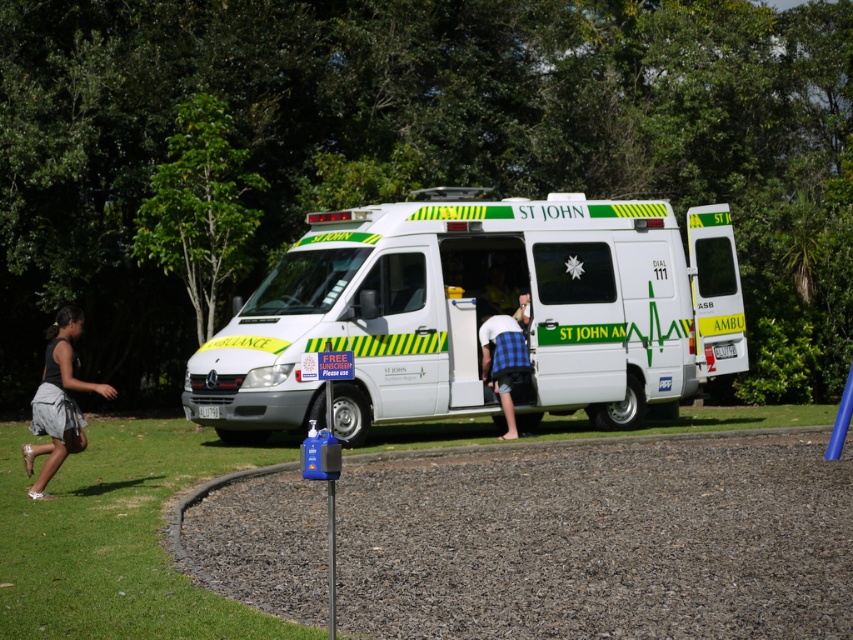
Question: Where is white glossy ambulance at center located in relation to blue plaid shirt at center in the image?

Choices:
 (A) right
 (B) left

Answer: (B)

Question: Which of these objects is positioned farthest from the white glossy ambulance at center?

Choices:
 (A) gray cotton skirt at lower left
 (B) blue plaid shirt at center

Answer: (A)

Question: Which of the following is the closest to the observer?

Choices:
 (A) gray cotton skirt at lower left
 (B) white glossy ambulance at center

Answer: (A)

Question: Among these objects, which one is farthest from the camera?

Choices:
 (A) white glossy ambulance at center
 (B) gray cotton skirt at lower left

Answer: (A)

Question: Does white glossy ambulance at center lie behind gray cotton skirt at lower left?

Choices:
 (A) yes
 (B) no

Answer: (A)

Question: Does white glossy ambulance at center appear on the left side of gray cotton skirt at lower left?

Choices:
 (A) no
 (B) yes

Answer: (A)